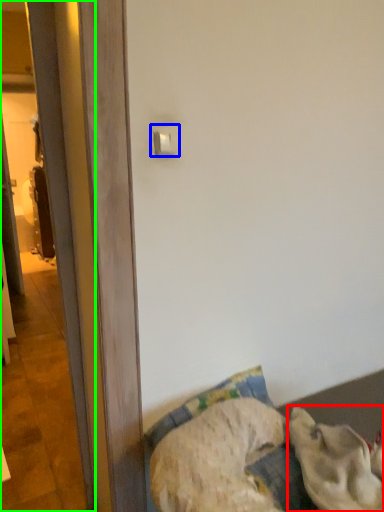
Question: Based on their relative distances, which object is farther from animal (highlighted by a red box)? Choose from light switch (highlighted by a blue box) and screen door (highlighted by a green box).

Choices:
 (A) light switch
 (B) screen door

Answer: (A)